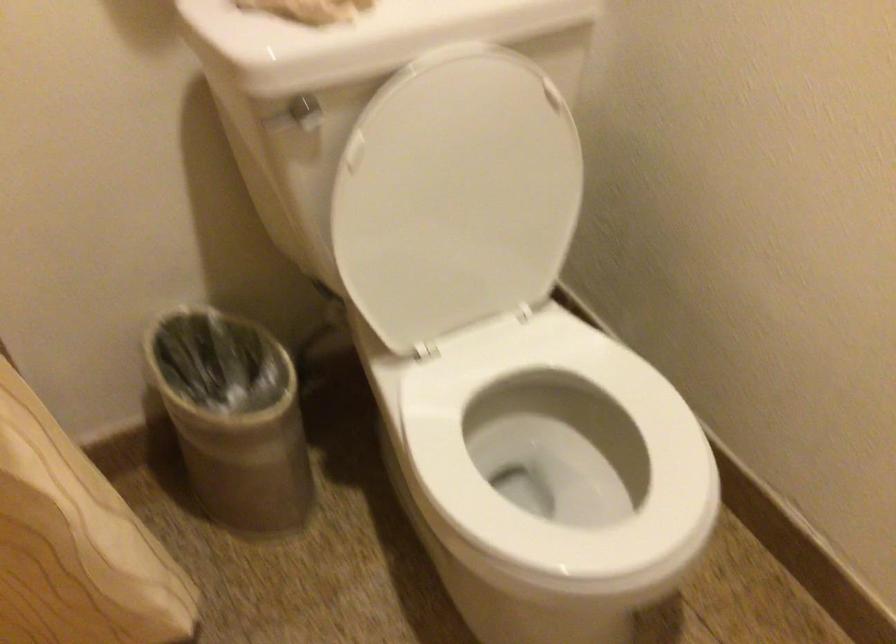
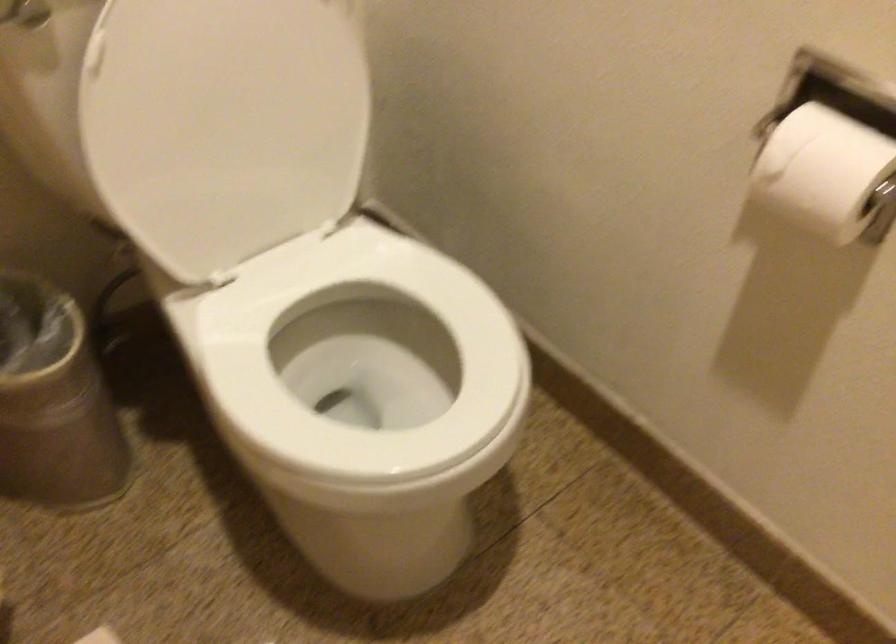
In the second image, find the point that corresponds to point (256, 446) in the first image.

(54, 402)